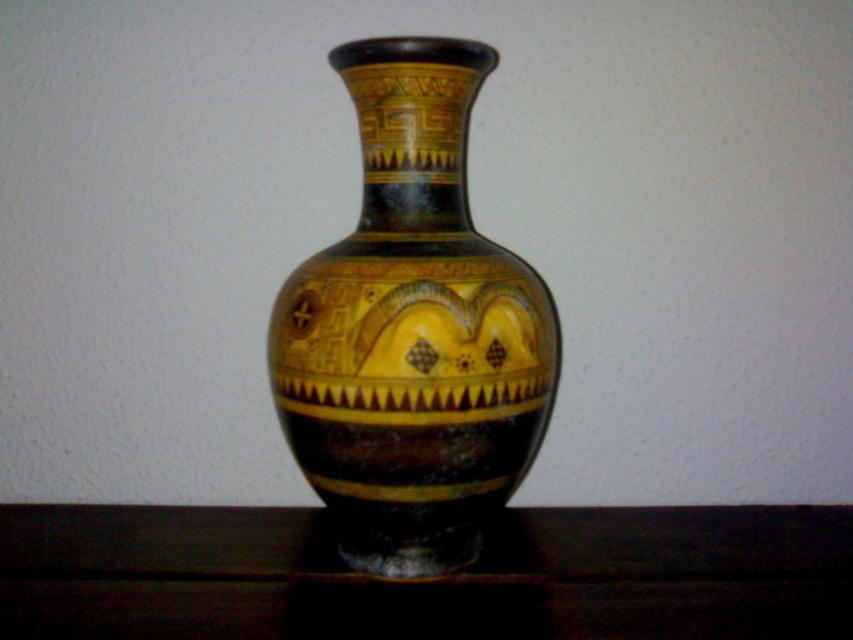
Question: Is matte black vase at center further to camera compared to glossy wood table at lower center?

Choices:
 (A) yes
 (B) no

Answer: (A)

Question: Is matte black vase at center in front of glossy wood table at lower center?

Choices:
 (A) yes
 (B) no

Answer: (B)

Question: Which object is farther from the camera taking this photo?

Choices:
 (A) glossy wood table at lower center
 (B) matte black vase at center

Answer: (B)

Question: Which point is closer to the camera?

Choices:
 (A) (323, 525)
 (B) (486, 413)

Answer: (B)

Question: Can you confirm if matte black vase at center is wider than glossy wood table at lower center?

Choices:
 (A) no
 (B) yes

Answer: (A)